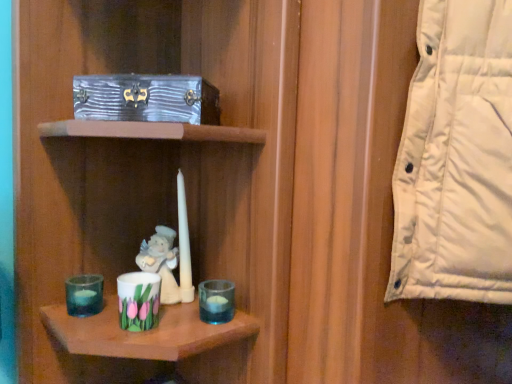
Question: Looking at their shapes, would you say metallic silver box at upper left is wider or thinner than transparent glass candle holder at lower left, the 3th candle holder when ordered from right to left?

Choices:
 (A) thin
 (B) wide

Answer: (B)

Question: Considering the positions of metallic silver box at upper left and transparent glass candle holder at lower left, the 3th candle holder when ordered from right to left, in the image, is metallic silver box at upper left bigger or smaller than transparent glass candle holder at lower left, the 3th candle holder when ordered from right to left,?

Choices:
 (A) small
 (B) big

Answer: (B)

Question: Considering the real-world distances, which object is closest to the metallic silver box at upper left?

Choices:
 (A) porcelain angel at center
 (B) porcelain floral cup at lower center, arranged as the 2th candle holder when viewed from the left
 (C) transparent glass candle holder at lower left, the 3th candle holder when ordered from right to left
 (D) transparent glass candle holder at lower center, arranged as the 1th candle holder when viewed from the right
 (E) white matte birthday candle at center

Answer: (E)

Question: Estimate the real-world distances between objects in this image. Which object is closer to the porcelain floral cup at lower center, arranged as the 2th candle holder when viewed from the left?

Choices:
 (A) metallic silver box at upper left
 (B) porcelain angel at center
 (C) transparent glass candle holder at lower center, arranged as the 1th candle holder when viewed from the right
 (D) transparent glass candle holder at lower left, acting as the first candle holder starting from the left
 (E) white matte birthday candle at center

Answer: (B)